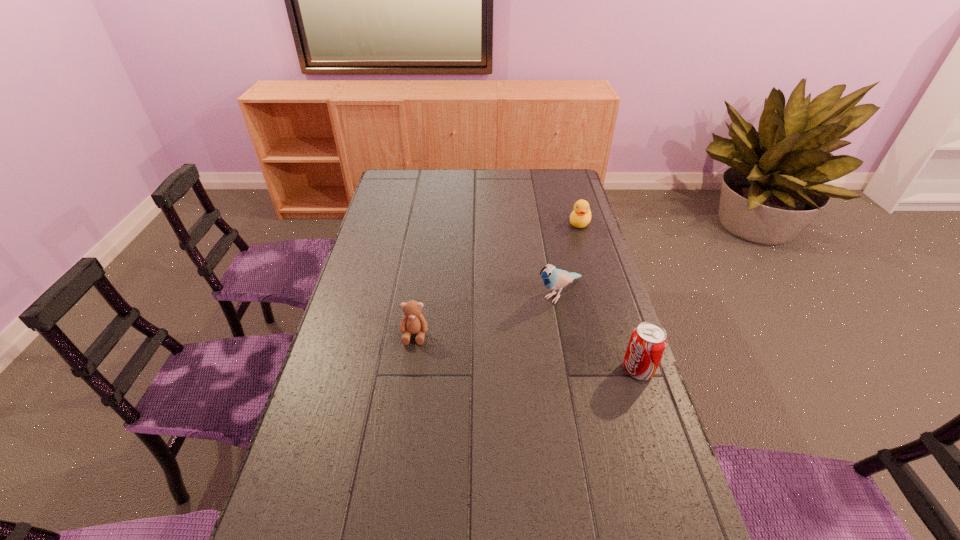
The height and width of the screenshot is (540, 960). I want to click on free spot on the desktop that is between the leftmost object and the nearest object and is positioned at the face of the bird, so click(x=492, y=347).

Where is `free space on the desktop that is between the leftmost object and the nearest object and is positioned on the face of the farthest object`? free space on the desktop that is between the leftmost object and the nearest object and is positioned on the face of the farthest object is located at coordinates (522, 351).